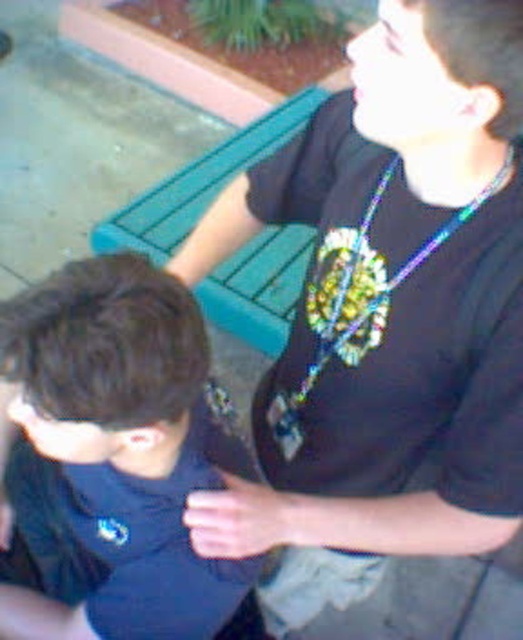
Question: Does dark blue fabric at lower left have a greater width compared to holographic plastic necklace at center?

Choices:
 (A) no
 (B) yes

Answer: (B)

Question: Is the position of dark blue fabric at lower left more distant than that of teal wood park bench at upper center?

Choices:
 (A) no
 (B) yes

Answer: (A)

Question: Which object is positioned closest to the black matte shirt at upper right?

Choices:
 (A) holographic plastic necklace at center
 (B) teal wood park bench at upper center
 (C) dark blue fabric at lower left

Answer: (A)

Question: Among these objects, which one is farthest from the camera?

Choices:
 (A) dark blue fabric at lower left
 (B) black matte shirt at upper right
 (C) teal wood park bench at upper center

Answer: (C)

Question: Which point appears farthest from the camera in this image?

Choices:
 (A) (338, 291)
 (B) (187, 196)

Answer: (B)

Question: Does black matte shirt at upper right appear under dark blue fabric at lower left?

Choices:
 (A) yes
 (B) no

Answer: (B)